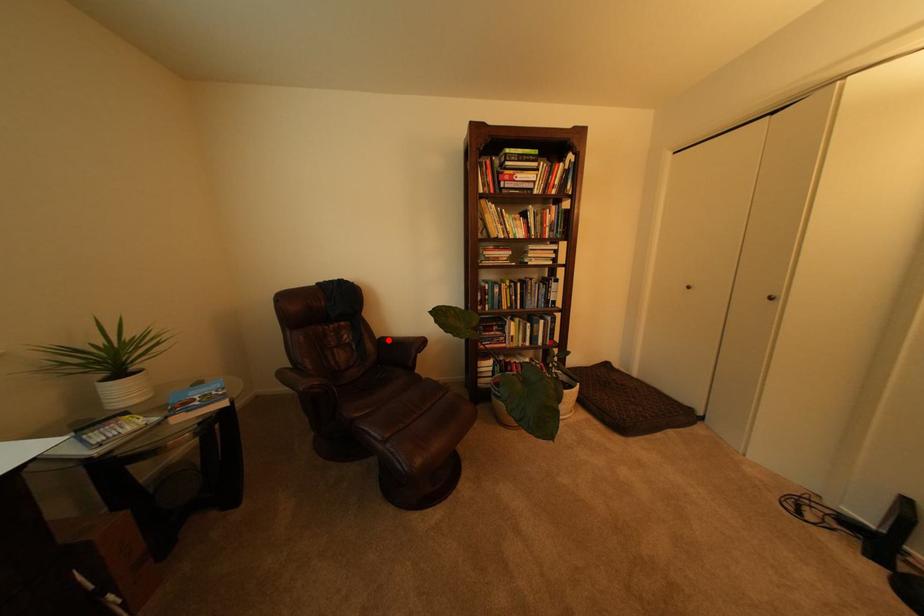
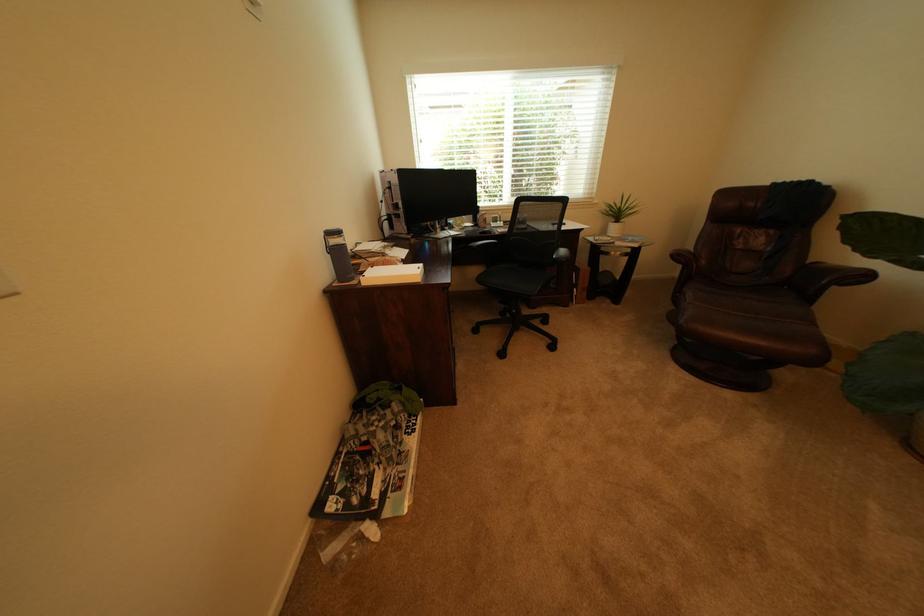
Question: I am providing you with two images of the same scene from different viewpoints. A red point is shown in image1. For the corresponding object point in image2, is it positioned nearer or farther from the camera?

Choices:
 (A) Nearer
 (B) Farther

Answer: (B)